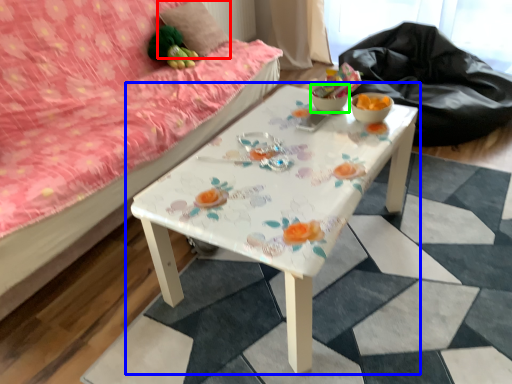
Question: Estimate the real-world distances between objects in this image. Which object is closer to pillow (highlighted by a red box), table (highlighted by a blue box) or glass bowl (highlighted by a green box)?

Choices:
 (A) table
 (B) glass bowl

Answer: (B)